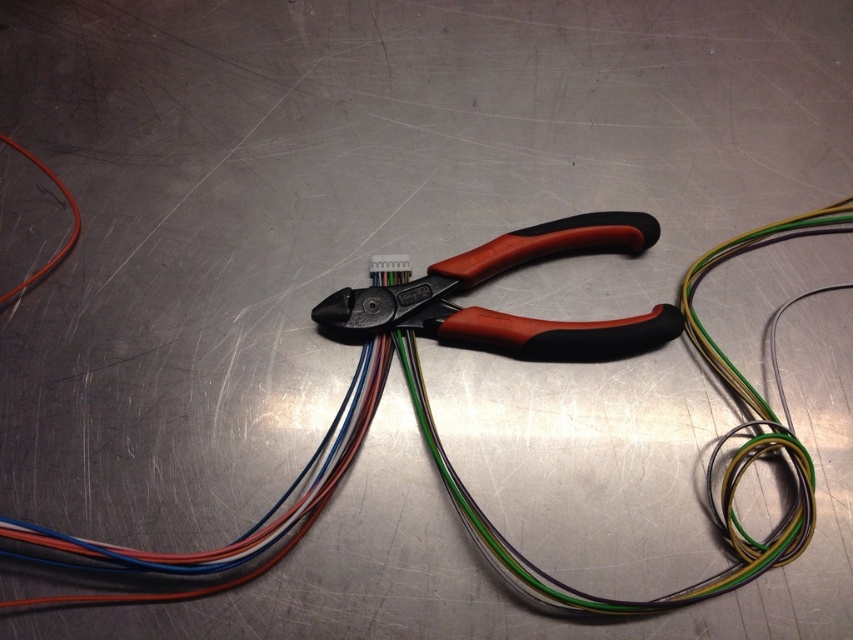
You are organizing tools on a workbench and need to place a new tool between the orange rubberized pliers at center and the matte black pliers at center. However, there is only space for one tool. Which pliers should you move to make room?

You should move the orange rubberized pliers at center to the right since it is already positioned to the right of the matte black pliers at center, allowing space to place the new tool between them by shifting the orange ones further right.

You are a technician who needs to reach the orange cable at left while standing 3 feet away from the workbench. Can you comfortably reach it without moving your position?

The orange cable at left is 4.15 feet away from the viewer, which is farther than your 3 feet distance from the workbench. Therefore, you cannot comfortably reach it without moving closer.